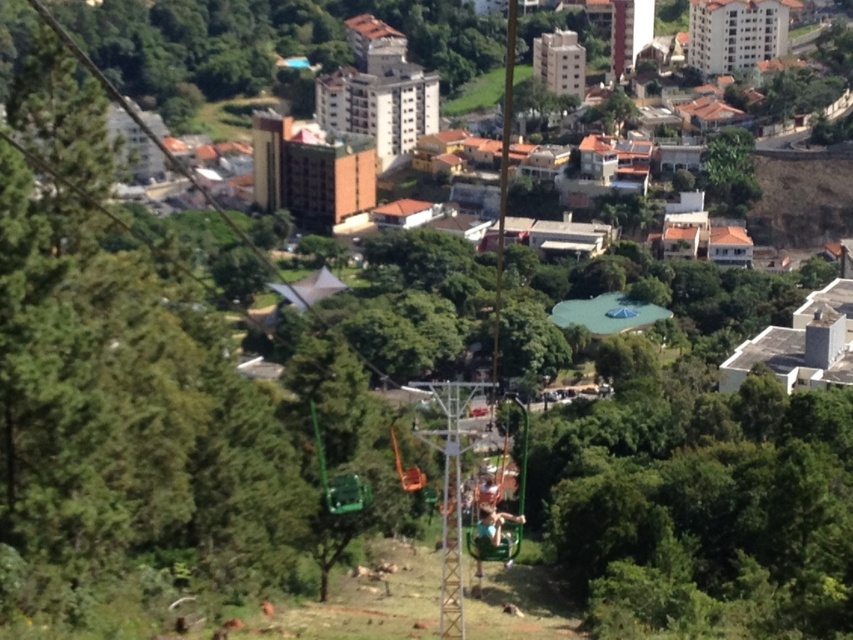
The height and width of the screenshot is (640, 853). What do you see at coordinates (701, 508) in the screenshot? I see `green leafy tree at center` at bounding box center [701, 508].

Can you confirm if green leafy tree at center is positioned to the right of green leafy tree at upper right?

In fact, green leafy tree at center is to the left of green leafy tree at upper right.

Is point (547, 433) behind point (727, 166)?

No, it is in front of (727, 166).

Identify the location of green leafy tree at center. (701, 508).